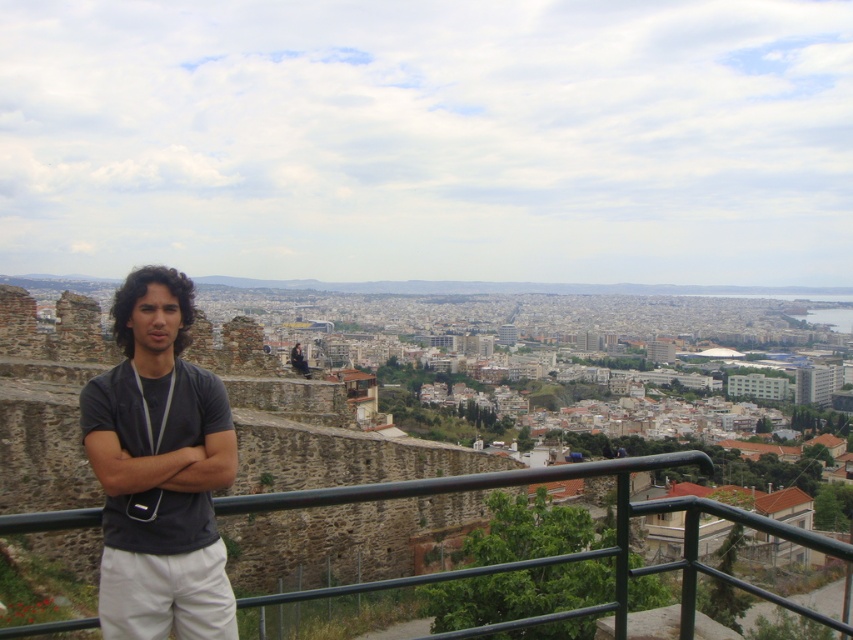
You are standing at the viewpoint and want to take a photo of the city. There are two points of interest marked as point 1 at coordinates (187, 499) and point 2 at coordinates (688, 604). Which point is closer to you when you look through the camera viewfinder?

Point 1 at coordinates (187, 499) is closer to you because it is further to the camera than point 2 at coordinates (688, 604).